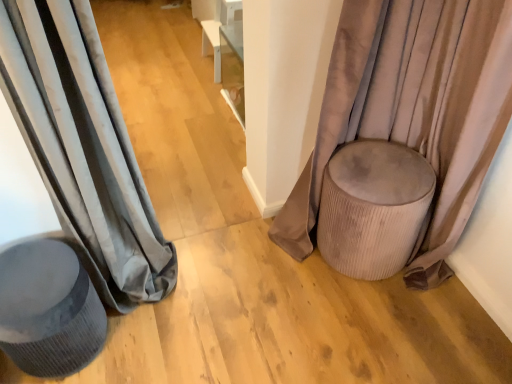
Identify the location of free spot in front of matte gray curtain at left, the 1th curtain viewed from the left. click(x=162, y=343).